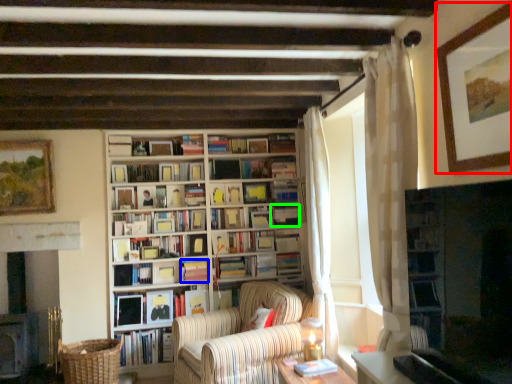
Question: Based on their relative distances, which object is farther from picture frame (highlighted by a red box)? Choose from book (highlighted by a blue box) and book (highlighted by a green box).

Choices:
 (A) book
 (B) book

Answer: (A)